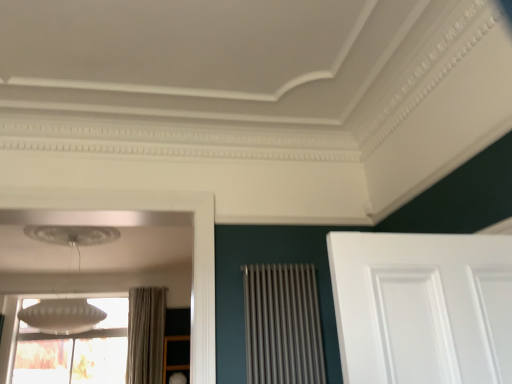
Describe the element at coordinates (282, 325) in the screenshot. The width and height of the screenshot is (512, 384). I see `metallic silver radiator at center` at that location.

Based on the photo, in order to face white frosted glass window at lower left, should I rotate leftwards or rightwards?

Turn left approximately 24.067 degrees to face it.

Find the location of a particular element. This screenshot has width=512, height=384. wooden shelf at lower left is located at coordinates (166, 355).

You are a GUI agent. You are given a task and a screenshot of the screen. Output one action in this format:
    pyautogui.click(x=<x>, y=<y>)
    Task: Click on the lamp in front of the matte gray curtain at left
    This screenshot has height=384, width=512.
    Given the screenshot: What is the action you would take?
    pyautogui.click(x=62, y=316)

Could you tell me if white frosted glass lampshade at upper left is facing matte gray curtain at left?

No, white frosted glass lampshade at upper left is not turned towards matte gray curtain at left.

Would you say matte gray curtain at left is part of white frosted glass lampshade at upper left's contents?

No, matte gray curtain at left is located outside of white frosted glass lampshade at upper left.

Is white frosted glass lampshade at upper left positioned far away from matte gray curtain at left?

Yes, white frosted glass lampshade at upper left is far from matte gray curtain at left.

Based on the photo, does white frosted glass window at lower left have a lesser height compared to white frosted glass lampshade at upper left?

In fact, white frosted glass window at lower left may be taller than white frosted glass lampshade at upper left.

How many degrees apart are the facing directions of white frosted glass window at lower left and white frosted glass lampshade at upper left?

white frosted glass window at lower left and white frosted glass lampshade at upper left are facing 0.453 degrees away from each other.

At what (x,y) coordinates should I click in order to perform the action: click on window behind the white frosted glass lampshade at upper left. Please return your answer as a coordinate pair (x, y). Looking at the image, I should click on (75, 351).

Between white frosted glass window at lower left and white frosted glass lampshade at upper left, which one appears on the left side from the viewer's perspective?

From the viewer's perspective, white frosted glass window at lower left appears more on the left side.

Could you tell me if matte gray curtain at left is facing white frosted glass lampshade at upper left?

Yes.

Which object is closer to the camera taking this photo, matte gray curtain at left or white frosted glass lampshade at upper left?

white frosted glass lampshade at upper left.

Does matte gray curtain at left contain white frosted glass lampshade at upper left?

No, white frosted glass lampshade at upper left is not inside matte gray curtain at left.

Is metallic silver radiator at center thinner than white frosted glass lampshade at upper left?

Yes, metallic silver radiator at center is thinner than white frosted glass lampshade at upper left.

From a real-world perspective, is metallic silver radiator at center physically above white frosted glass lampshade at upper left?

No, from a real-world perspective, metallic silver radiator at center is not above white frosted glass lampshade at upper left.

Looking at the image, does metallic silver radiator at center seem bigger or smaller compared to white frosted glass lampshade at upper left?

Clearly, metallic silver radiator at center is smaller in size than white frosted glass lampshade at upper left.

Could you measure the distance between metallic silver radiator at center and white frosted glass lampshade at upper left?

metallic silver radiator at center and white frosted glass lampshade at upper left are 9.31 feet apart from each other.

From the picture: Would you say wooden shelf at lower left is part of white frosted glass lampshade at upper left's contents?

No, wooden shelf at lower left is not inside white frosted glass lampshade at upper left.

Is white frosted glass lampshade at upper left next to wooden shelf at lower left?

No, white frosted glass lampshade at upper left is not making contact with wooden shelf at lower left.

Does point (79, 310) come in front of point (166, 362)?

That is True.

Which object is wider, white frosted glass lampshade at upper left or wooden shelf at lower left?

With larger width is white frosted glass lampshade at upper left.

Is wooden shelf at lower left shorter than white frosted glass lampshade at upper left?

Yes.

Considering the sizes of objects wooden shelf at lower left and white frosted glass lampshade at upper left in the image provided, who is smaller, wooden shelf at lower left or white frosted glass lampshade at upper left?

wooden shelf at lower left is smaller.

Find the location of a particular element. This screenshot has height=384, width=512. furniture beneath the white frosted glass lampshade at upper left (from a real-world perspective) is located at coordinates (166, 355).

Based on the photo, is matte gray curtain at left at the back of metallic silver radiator at center?

Yes, metallic silver radiator at center is positioned with its back facing matte gray curtain at left.

From a real-world perspective, relative to matte gray curtain at left, is metallic silver radiator at center vertically above or below?

In terms of real-world spatial position, metallic silver radiator at center is below matte gray curtain at left.

Which object is more forward, metallic silver radiator at center or matte gray curtain at left?

metallic silver radiator at center.

Where is `curtain that is under the white frosted glass lampshade at upper left (from a real-world perspective)`? The image size is (512, 384). curtain that is under the white frosted glass lampshade at upper left (from a real-world perspective) is located at coordinates (146, 335).

I want to click on lamp on the right of white frosted glass window at lower left, so click(62, 316).

Considering their positions, is matte gray curtain at left positioned further to metallic silver radiator at center than wooden shelf at lower left?

The object further to metallic silver radiator at center is wooden shelf at lower left.

Considering their positions, is white frosted glass lampshade at upper left positioned closer to wooden shelf at lower left than matte gray curtain at left?

matte gray curtain at left is positioned closer to the anchor wooden shelf at lower left.

Which object lies further to the anchor point wooden shelf at lower left, white frosted glass window at lower left or metallic silver radiator at center?

metallic silver radiator at center is further to wooden shelf at lower left.

When comparing their distances from white frosted glass window at lower left, does metallic silver radiator at center or wooden shelf at lower left seem closer?

wooden shelf at lower left.

From the image, which object appears to be farther from metallic silver radiator at center, matte gray curtain at left or white frosted glass lampshade at upper left?

matte gray curtain at left lies further to metallic silver radiator at center than the other object.

When comparing their distances from white frosted glass window at lower left, does matte gray curtain at left or white frosted glass lampshade at upper left seem further?

matte gray curtain at left lies further to white frosted glass window at lower left than the other object.

Which object lies further to the anchor point wooden shelf at lower left, metallic silver radiator at center or white frosted glass window at lower left?

metallic silver radiator at center is further to wooden shelf at lower left.

When comparing their distances from white frosted glass window at lower left, does white frosted glass lampshade at upper left or metallic silver radiator at center seem further?

metallic silver radiator at center.

Find the location of a particular element. The image size is (512, 384). curtain located between white frosted glass window at lower left and wooden shelf at lower left in the left-right direction is located at coordinates (146, 335).

Where is `curtain between white frosted glass lampshade at upper left and white frosted glass window at lower left from front to back`? The image size is (512, 384). curtain between white frosted glass lampshade at upper left and white frosted glass window at lower left from front to back is located at coordinates click(x=146, y=335).

You are a GUI agent. You are given a task and a screenshot of the screen. Output one action in this format:
    pyautogui.click(x=<x>, y=<y>)
    Task: Click on the furniture between white frosted glass lampshade at upper left and white frosted glass window at lower left in the front-back direction
    This screenshot has width=512, height=384.
    Given the screenshot: What is the action you would take?
    pyautogui.click(x=166, y=355)

Where is `lamp between metallic silver radiator at center and matte gray curtain at left along the z-axis`? lamp between metallic silver radiator at center and matte gray curtain at left along the z-axis is located at coordinates (62, 316).